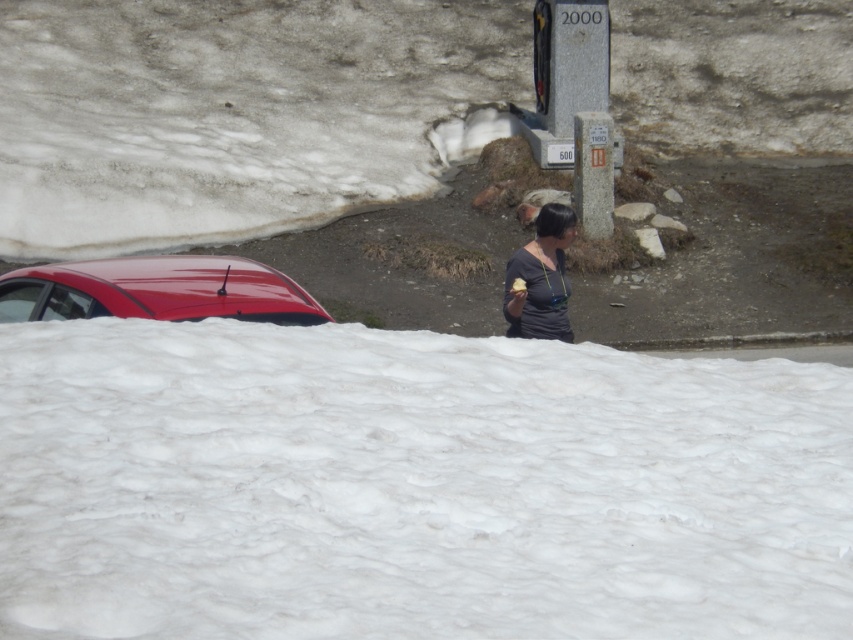
Question: Which object is the farthest from the white fluffy snow at lower center?

Choices:
 (A) dark gray matte shirt at center
 (B) glossy red car at upper left
 (C) vanilla ice cream at center

Answer: (A)

Question: Can you confirm if white fluffy snow at lower center is wider than vanilla ice cream at center?

Choices:
 (A) yes
 (B) no

Answer: (A)

Question: Which point is farther from the camera taking this photo?

Choices:
 (A) (225, 284)
 (B) (561, 296)

Answer: (B)

Question: Does white fluffy snow at lower center appear on the right side of glossy red car at upper left?

Choices:
 (A) yes
 (B) no

Answer: (A)

Question: Among these points, which one is farthest from the camera?

Choices:
 (A) (289, 513)
 (B) (524, 282)
 (C) (196, 260)
 (D) (529, 252)

Answer: (C)

Question: Is dark gray matte shirt at center thinner than vanilla ice cream at center?

Choices:
 (A) no
 (B) yes

Answer: (A)